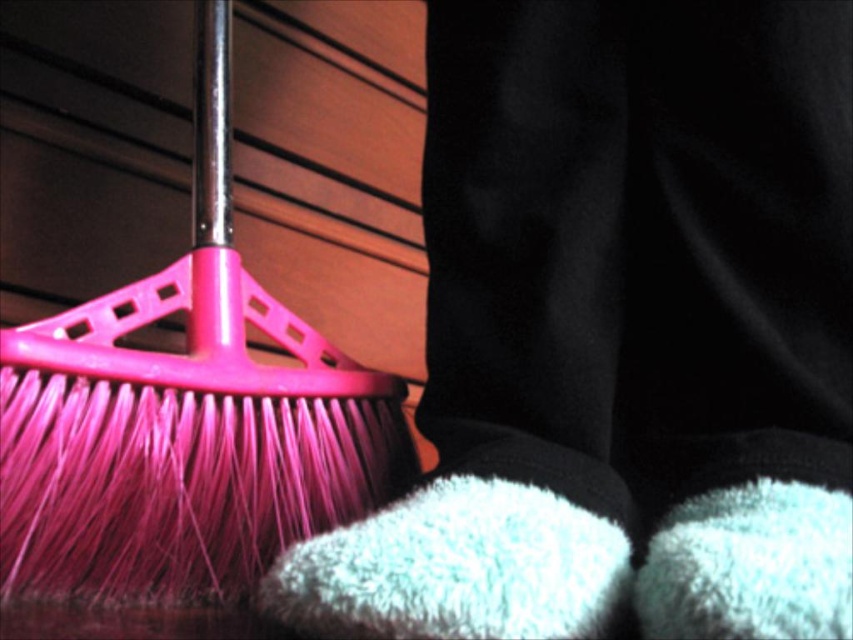
Consider the image. Can you confirm if pink plastic brush at left is smaller than fuzzy white sock at lower center?

No, pink plastic brush at left is not smaller than fuzzy white sock at lower center.

Measure the distance from pink plastic brush at left to fuzzy white sock at lower center.

The distance of pink plastic brush at left from fuzzy white sock at lower center is 8.00 inches.

Between point (78, 378) and point (297, 614), which one is positioned behind?

The point (78, 378) is behind.

Identify the location of pink plastic brush at left. This screenshot has height=640, width=853. (184, 417).